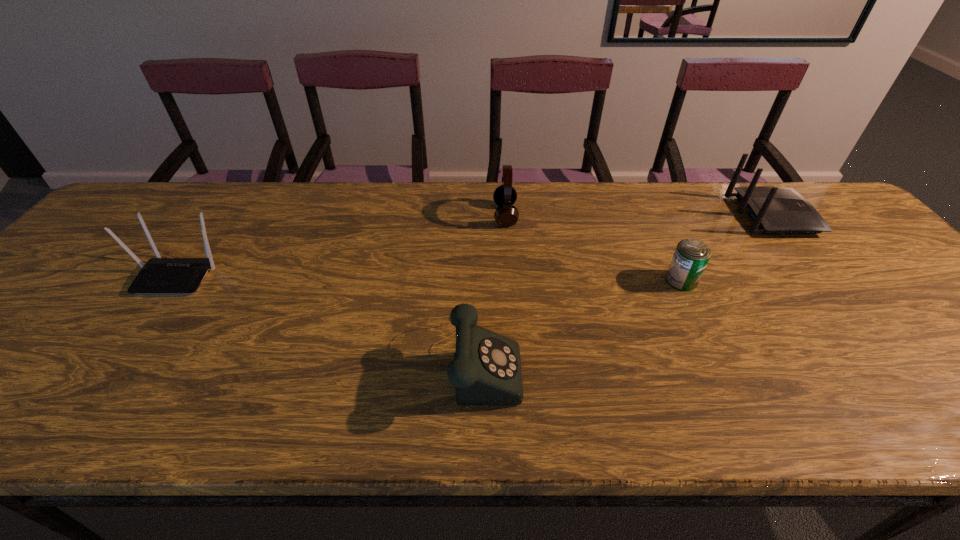
Locate an element on the screen. The height and width of the screenshot is (540, 960). headset is located at coordinates (506, 215).

Locate an element on the screen. Image resolution: width=960 pixels, height=540 pixels. the rightmost object is located at coordinates tap(774, 210).

At what (x,y) coordinates should I click in order to perform the action: click on the farther router. Please return your answer as a coordinate pair (x, y). This screenshot has width=960, height=540. Looking at the image, I should click on (774, 210).

Find the location of a particular element. The image size is (960, 540). the leftmost object is located at coordinates (159, 275).

Find the location of a particular element. The height and width of the screenshot is (540, 960). the nearer router is located at coordinates (159, 275).

At what (x,y) coordinates should I click in order to perform the action: click on telephone. Please return your answer as a coordinate pair (x, y). Looking at the image, I should click on (486, 370).

Identify the location of can. Image resolution: width=960 pixels, height=540 pixels. (691, 256).

Locate an element on the screen. The width and height of the screenshot is (960, 540). the fourth object from left to right is located at coordinates (691, 256).

I want to click on vacant space located on the ear pads of the headset, so click(x=405, y=215).

Identify the location of vacant position located 0.150m on the ear pads of the headset. click(x=443, y=215).